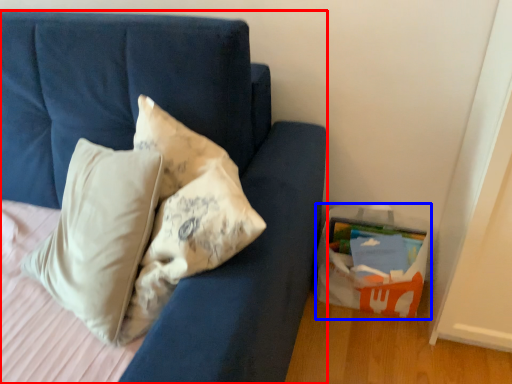
Question: Among these objects, which one is farthest to the camera, furniture (highlighted by a red box) or cardboard box (highlighted by a blue box)?

Choices:
 (A) furniture
 (B) cardboard box

Answer: (B)